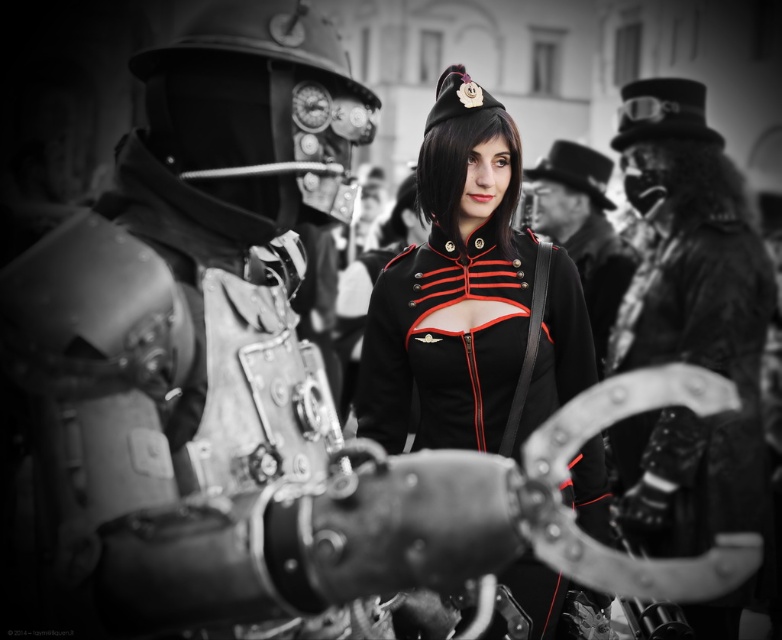
You are a photographer at a steampunk event. You need to capture a photo where both the black matte uniform at center and the fur coat at right are visible. Given their height difference, which one might appear larger in the photo?

The black matte uniform at center appears larger in the photo because it has a greater height compared to the fur coat at right.

You are a costume designer preparing for a steampunk play. You need to decide which piece of clothing to prioritize based on size. Given the black matte uniform at center and the black leather jacket at center, which one requires more fabric to make?

The black leather jacket at center requires more fabric since it is larger than the black matte uniform at center.